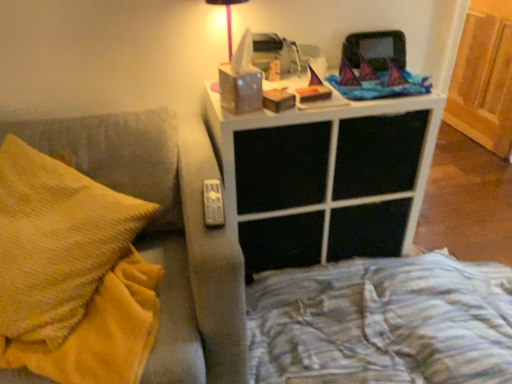
The image size is (512, 384). Describe the element at coordinates (102, 332) in the screenshot. I see `yellow fleece blanket at left` at that location.

Where is `wooden bed frame at lower right`? Image resolution: width=512 pixels, height=384 pixels. wooden bed frame at lower right is located at coordinates (382, 323).

The width and height of the screenshot is (512, 384). What are the coordinates of `yellow fleece blanket at left` in the screenshot? It's located at (102, 332).

The image size is (512, 384). Identify the location of blanket lying behind the suede-like gray couch armrest at left. (102, 332).

Measure the distance between yellow fleece blanket at left and suede-like gray couch armrest at left.

yellow fleece blanket at left and suede-like gray couch armrest at left are 8.03 inches apart.

Which is less distant, (150, 311) or (178, 148)?

The point (150, 311) is in front.

From the image's perspective, which one is positioned lower, yellow fleece blanket at left or suede-like gray couch armrest at left?

yellow fleece blanket at left is shown below in the image.

Which of these two, wooden bed frame at lower right or yellow fleece blanket at left, stands shorter?

yellow fleece blanket at left.

Can you tell me how much wooden bed frame at lower right and yellow fleece blanket at left differ in facing direction?

There is a 0.000408-degree angle between the facing directions of wooden bed frame at lower right and yellow fleece blanket at left.

At what (x,y) coordinates should I click in order to perform the action: click on bed frame behind the yellow fleece blanket at left. Please return your answer as a coordinate pair (x, y). Looking at the image, I should click on (382, 323).

From the image's perspective, which object appears higher, wooden bed frame at lower right or yellow fleece blanket at left?

yellow fleece blanket at left appears higher in the image.

From the picture: Are matte white tissue box at upper center and white matte nightstand at upper center located far from each other?

No, matte white tissue box at upper center is in close proximity to white matte nightstand at upper center.

Consider the image. Is matte white tissue box at upper center looking in the opposite direction of white matte nightstand at upper center?

That's not correct — matte white tissue box at upper center is not looking away from white matte nightstand at upper center.

Is matte white tissue box at upper center to the right of white matte nightstand at upper center from the viewer's perspective?

No.

Which of these two, matte white tissue box at upper center or white matte nightstand at upper center, is smaller?

With smaller size is matte white tissue box at upper center.

Is point (389, 190) farther from camera compared to point (229, 14)?

Yes, it is behind point (229, 14).

Who is bigger, white matte nightstand at upper center or matte white tissue box at upper center?

With larger size is white matte nightstand at upper center.

Locate an element on the screen. This screenshot has width=512, height=384. nightstand that is under the matte white tissue box at upper center (from a real-world perspective) is located at coordinates (326, 178).

Between white matte nightstand at upper center and matte white tissue box at upper center, which one appears on the left side from the viewer's perspective?

From the viewer's perspective, matte white tissue box at upper center appears more on the left side.

Is matte white tissue box at upper center next to yellow fleece blanket at left?

matte white tissue box at upper center and yellow fleece blanket at left are not in contact.

From the image's perspective, is matte white tissue box at upper center under yellow fleece blanket at left?

No.

Between matte white tissue box at upper center and yellow fleece blanket at left, which one has larger size?

With larger size is yellow fleece blanket at left.

Which is more to the left, white matte nightstand at upper center or yellow fleece blanket at left?

yellow fleece blanket at left is more to the left.

Is white matte nightstand at upper center in front of yellow fleece blanket at left?

That is False.

Where is `nightstand behind the yellow fleece blanket at left`? nightstand behind the yellow fleece blanket at left is located at coordinates (326, 178).

Between point (414, 163) and point (101, 288), which one is positioned behind?

Point (414, 163)

Which point is more forward, (231, 34) or (348, 364)?

The point (348, 364) is closer to the camera.

From the picture: Is matte white tissue box at upper center beside wooden bed frame at lower right?

No.

Looking at this image, from a real-world perspective, is matte white tissue box at upper center physically located above or below wooden bed frame at lower right?

Clearly, from a real-world perspective, matte white tissue box at upper center is above wooden bed frame at lower right.

Is matte white tissue box at upper center turned away from wooden bed frame at lower right?

No, matte white tissue box at upper center's orientation is not away from wooden bed frame at lower right.

You are a GUI agent. You are given a task and a screenshot of the screen. Output one action in this format:
    pyautogui.click(x=<x>, y=<y>)
    Task: Click on the blanket above the suede-like gray couch armrest at left (from a real-world perspective)
    This screenshot has width=512, height=384.
    Given the screenshot: What is the action you would take?
    pyautogui.click(x=102, y=332)

The height and width of the screenshot is (384, 512). I want to click on blanket that appears in front of the wooden bed frame at lower right, so click(x=102, y=332).

Based on their spatial positions, is yellow fleece blanket at left or wooden bed frame at lower right further from suede-like gray couch armrest at left?

wooden bed frame at lower right is positioned further to the anchor suede-like gray couch armrest at left.

Based on their spatial positions, is suede-like gray couch armrest at left or wooden bed frame at lower right further from white matte nightstand at upper center?

The object further to white matte nightstand at upper center is suede-like gray couch armrest at left.

From the image, which object appears to be nearer to suede-like gray couch armrest at left, wooden bed frame at lower right or matte white tissue box at upper center?

wooden bed frame at lower right is positioned closer to the anchor suede-like gray couch armrest at left.

Which object lies nearer to the anchor point matte white tissue box at upper center, wooden bed frame at lower right or yellow fleece blanket at left?

Among the two, yellow fleece blanket at left is located nearer to matte white tissue box at upper center.

When comparing their distances from wooden bed frame at lower right, does suede-like gray couch armrest at left or matte white tissue box at upper center seem closer?

Based on the image, suede-like gray couch armrest at left appears to be nearer to wooden bed frame at lower right.

Considering their positions, is wooden bed frame at lower right positioned closer to suede-like gray couch armrest at left than white matte nightstand at upper center?

Based on the image, white matte nightstand at upper center appears to be nearer to suede-like gray couch armrest at left.

Estimate the real-world distances between objects in this image. Which object is further from wooden bed frame at lower right, white matte nightstand at upper center or yellow fleece blanket at left?

yellow fleece blanket at left is further to wooden bed frame at lower right.

Considering their positions, is wooden bed frame at lower right positioned further to yellow fleece blanket at left than suede-like gray couch armrest at left?

Based on the image, wooden bed frame at lower right appears to be further to yellow fleece blanket at left.

Where is `table lamp situated between suede-like gray couch armrest at left and wooden bed frame at lower right from left to right`? table lamp situated between suede-like gray couch armrest at left and wooden bed frame at lower right from left to right is located at coordinates (227, 18).

At what (x,y) coordinates should I click in order to perform the action: click on blanket between matte white tissue box at upper center and wooden bed frame at lower right vertically. Please return your answer as a coordinate pair (x, y). Looking at the image, I should click on (102, 332).

Image resolution: width=512 pixels, height=384 pixels. I want to click on nightstand between yellow fleece blanket at left and wooden bed frame at lower right from left to right, so click(326, 178).

Where is `blanket located between suede-like gray couch armrest at left and white matte nightstand at upper center in the left-right direction`? Image resolution: width=512 pixels, height=384 pixels. blanket located between suede-like gray couch armrest at left and white matte nightstand at upper center in the left-right direction is located at coordinates (102, 332).